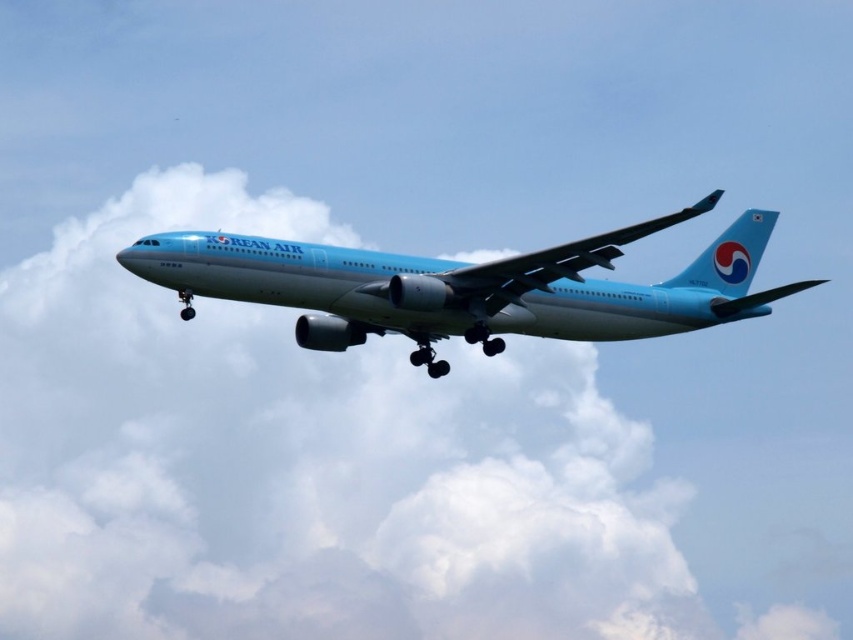
Question: Which point is farther to the camera?

Choices:
 (A) [670, 532]
 (B) [701, 200]

Answer: (A)

Question: Can you confirm if white fluffy cloud at upper center is positioned to the left of light blue metallic airplane at center?

Choices:
 (A) yes
 (B) no

Answer: (A)

Question: Does white fluffy cloud at upper center appear under light blue metallic airplane at center?

Choices:
 (A) no
 (B) yes

Answer: (B)

Question: Does white fluffy cloud at upper center appear under light blue metallic airplane at center?

Choices:
 (A) yes
 (B) no

Answer: (A)